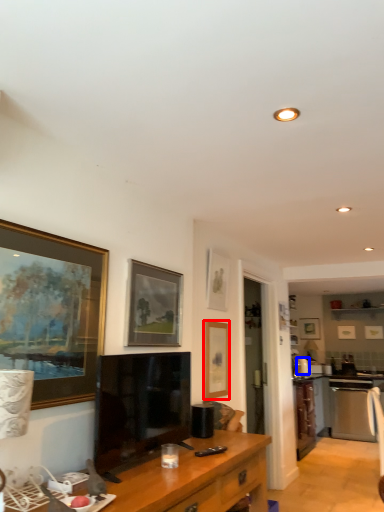
Question: Which object is further to the camera taking this photo, picture frame (highlighted by a red box) or appliance (highlighted by a blue box)?

Choices:
 (A) picture frame
 (B) appliance

Answer: (B)